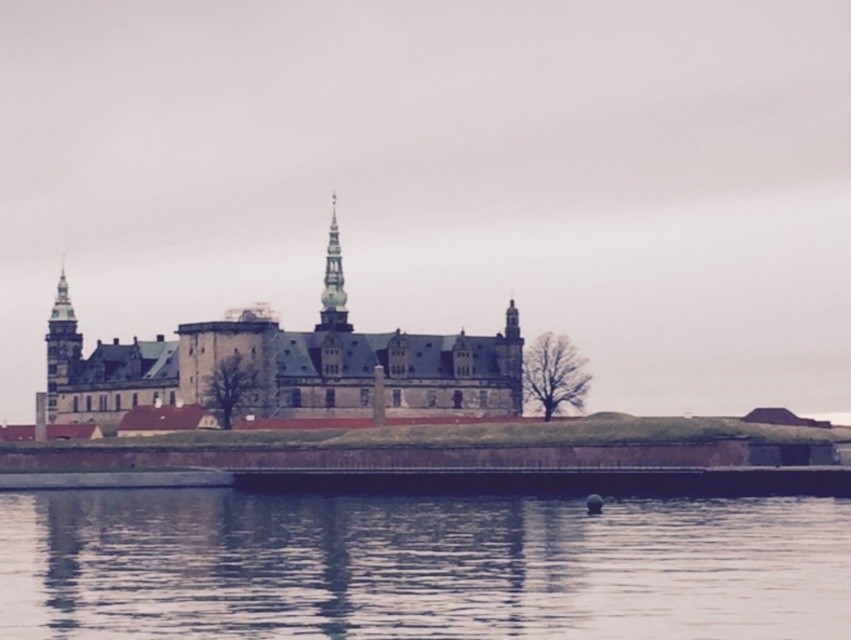
You are a tour guide explaining the castle layout to visitors. You mention the smooth water at lower center and the brown stone castle at center. Which one takes up more visual space in the image?

The brown stone castle at center occupies more visual space than the smooth water at lower center according to the description.

You are standing on the castle grounds and want to reach the point marked at coordinates (37, 506). Given that the moat surrounding the castle is 100 meters wide, can you safely cross it to reach that point without getting wet?

The point marked at coordinates (37, 506) is 112.00 meters away from the viewer. Since the moat is only 100 meters wide, the point is beyond the moat. Therefore, you can safely reach it without crossing the entire width of the moat.

You are a tour guide standing at the edge of the water, and you want to point out the distance between the smooth water at lower center and the brown stone castle at center to your visitors. What do you tell them?

The smooth water at lower center is 115.34 feet away from the brown stone castle at center.